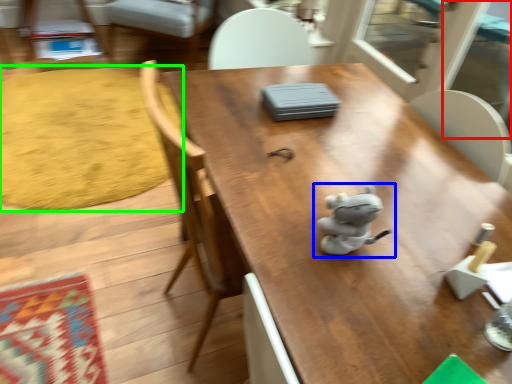
Question: Which object is the farthest from screen door (highlighted by a red box)? Choose among these: toy (highlighted by a blue box) or mat (highlighted by a green box).

Choices:
 (A) toy
 (B) mat

Answer: (A)